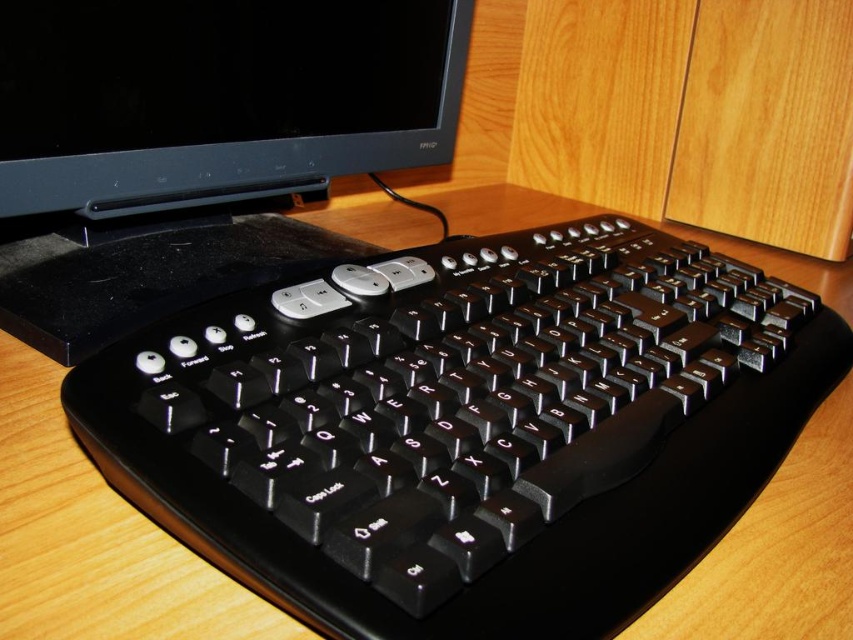
Can you confirm if black plastic monitor at upper center is shorter than wooden computer desk at center?

No.

Between point (250, 252) and point (476, 227), which one is positioned in front?

Point (250, 252) is more forward.

I want to click on black plastic monitor at upper center, so click(x=198, y=145).